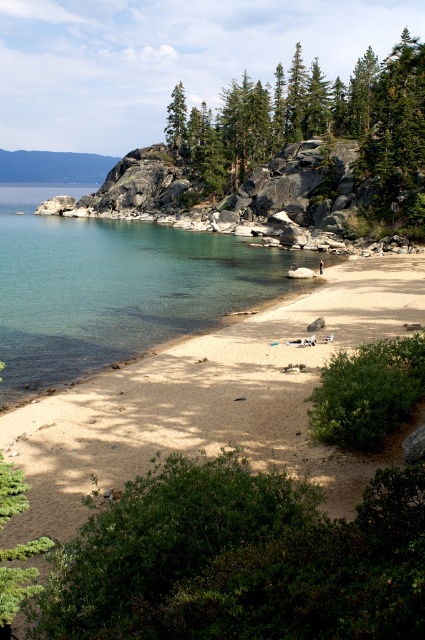
You are standing on the lakeside beach and looking towards the water. You see the clear glass water at center and the green textured pine trees at upper center. Which object is closer to you?

The clear glass water at center is closer to you because it is positioned in front of the green textured pine trees at upper center.

You are standing at the point marked by coordinates point (207, 397). Based on the scene description, what type of terrain are you currently standing on?

The light brown sand at center is represented by point (207, 397), so you are standing on light brown sand at center.